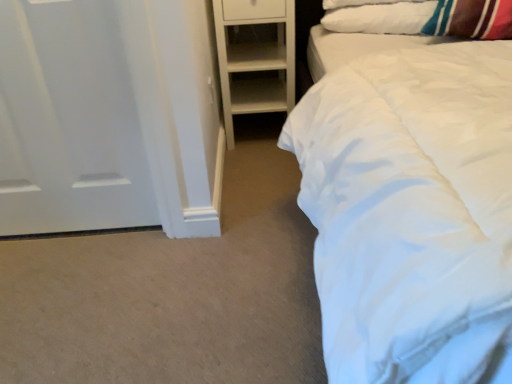
The height and width of the screenshot is (384, 512). Identify the location of unoccupied area in front of white matte door at left. (64, 282).